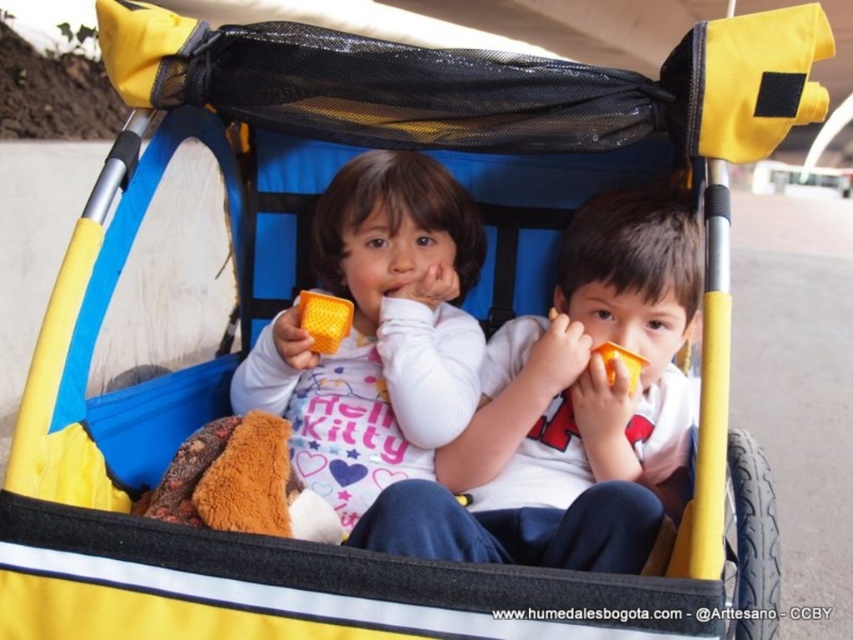
You are a parent observing the stroller with two children. You notice two orange cups at the center. Which cup is closer to you, the orange plastic cup at center or the matte orange cup at center?

The orange plastic cup at center is closer to you because it is positioned under the matte orange cup at center, meaning the matte orange cup is above it and farther away.

You are a parent trying to hand your child a bottle of water. You see two cups in the stroller, an orange plastic cup at center and a matte orange cup at center. Which cup is easier to reach without leaning forward?

The orange plastic cup at center is closer to the viewer than the matte orange cup at center, so it is easier to reach without leaning forward.

You are a parent trying to choose a cup for your child. Both the orange plastic cup at center and the matte orange cup at center are available. Which cup has a wider opening?

The orange plastic cup at center has a wider opening than the matte orange cup at center because its width surpasses the latter.